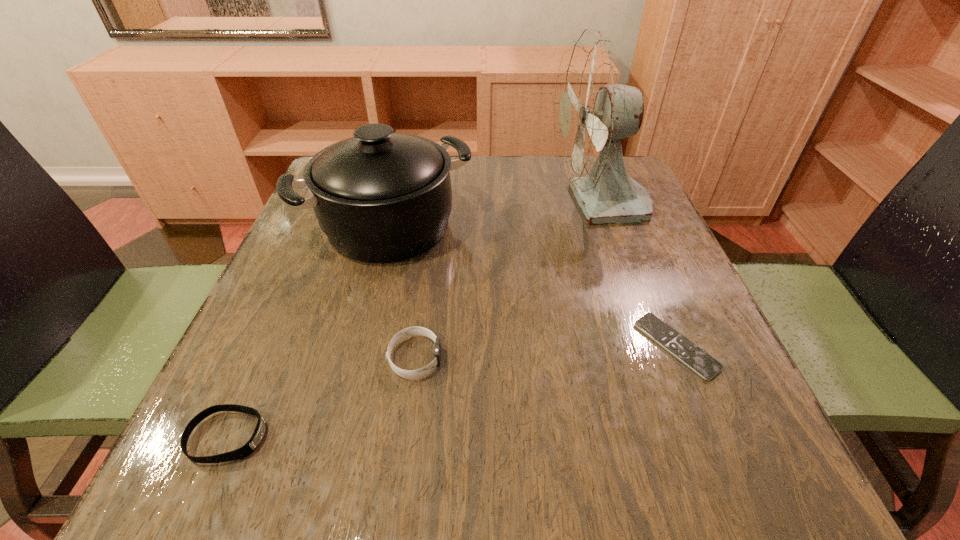
Identify the location of free space located on the back of the second tallest object. The width and height of the screenshot is (960, 540). pos(402,174).

The image size is (960, 540). Identify the location of vacant space located on the outer surface of the farther wristband. (684, 357).

The height and width of the screenshot is (540, 960). What are the coordinates of `free space located on the display of the nearest object` in the screenshot? It's located at (392, 437).

Where is `vacant point located on the left of the shortest object`? This screenshot has width=960, height=540. vacant point located on the left of the shortest object is located at coordinates (582, 346).

This screenshot has height=540, width=960. I want to click on fan that is at the far edge, so click(593, 110).

Where is `saucepan located at the far edge`? saucepan located at the far edge is located at coordinates (380, 197).

Where is `object positioned at the near edge`? Image resolution: width=960 pixels, height=540 pixels. object positioned at the near edge is located at coordinates (251, 445).

Where is `saucepan that is positioned at the left edge`? saucepan that is positioned at the left edge is located at coordinates (380, 197).

You are a GUI agent. You are given a task and a screenshot of the screen. Output one action in this format:
    pyautogui.click(x=<x>, y=<y>)
    Task: Click on the wristband present at the left edge
    The height and width of the screenshot is (540, 960).
    Given the screenshot: What is the action you would take?
    pyautogui.click(x=251, y=445)

This screenshot has height=540, width=960. Identify the location of fan at the right edge. (593, 110).